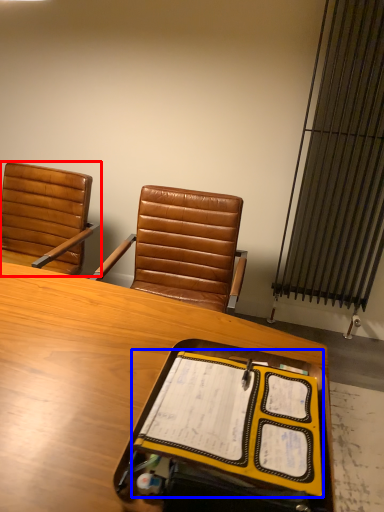
Question: Which of the following is the farthest to the observer, chair (highlighted by a red box) or notebook (highlighted by a blue box)?

Choices:
 (A) chair
 (B) notebook

Answer: (A)